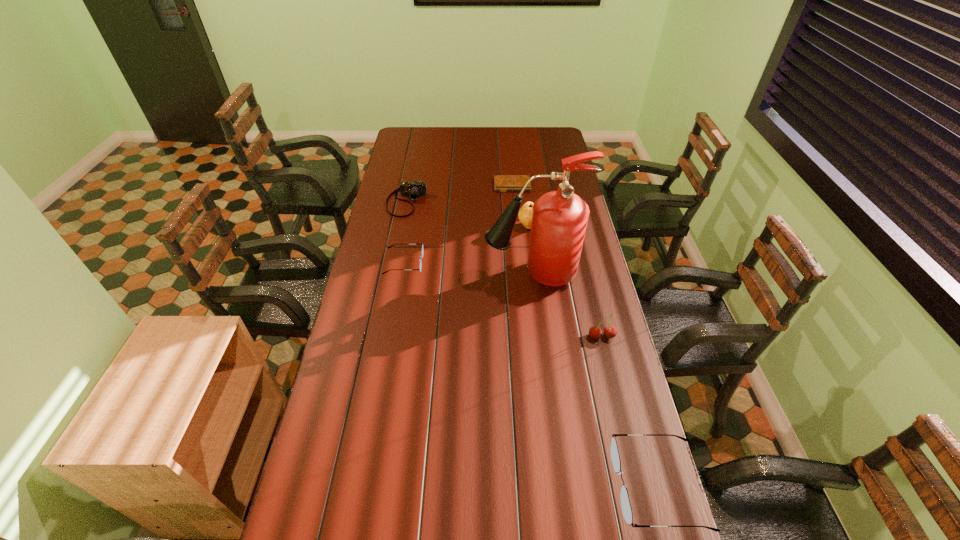
Find the location of a particular element. object at the near edge is located at coordinates [615, 457].

Find the location of a particular element. spectacles located in the left edge section of the desktop is located at coordinates (422, 251).

Find the location of `camera situated at the left edge`. camera situated at the left edge is located at coordinates coord(414,189).

At what (x,y) coordinates should I click in order to perform the action: click on spectacles that is at the right edge. Please return your answer as a coordinate pair (x, y). This screenshot has width=960, height=540. Looking at the image, I should click on (615, 457).

Find the location of a particular element. Image resolution: width=960 pixels, height=540 pixels. fire extinguisher that is at the right edge is located at coordinates (559, 219).

The width and height of the screenshot is (960, 540). What are the coordinates of `cherry present at the right edge` in the screenshot? It's located at (610, 331).

Where is `object located at the near right corner`? This screenshot has height=540, width=960. object located at the near right corner is located at coordinates (615, 457).

At what (x,y) coordinates should I click in order to perform the action: click on free spot at the far edge of the desktop. Please return your answer as a coordinate pair (x, y). Looking at the image, I should click on (501, 140).

Locate an element on the screen. blank space at the left edge of the desktop is located at coordinates (370, 314).

At what (x,y) coordinates should I click in order to perform the action: click on vacant space at the right edge of the desktop. Please return your answer as a coordinate pair (x, y). Looking at the image, I should click on (643, 447).